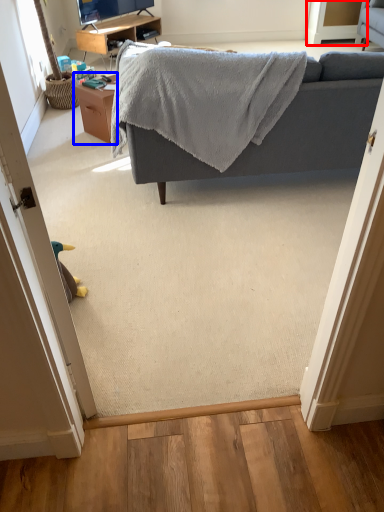
Question: Among these objects, which one is farthest to the camera, screen door (highlighted by a red box) or table (highlighted by a blue box)?

Choices:
 (A) screen door
 (B) table

Answer: (A)